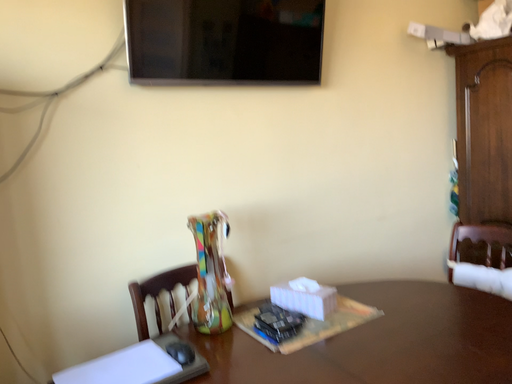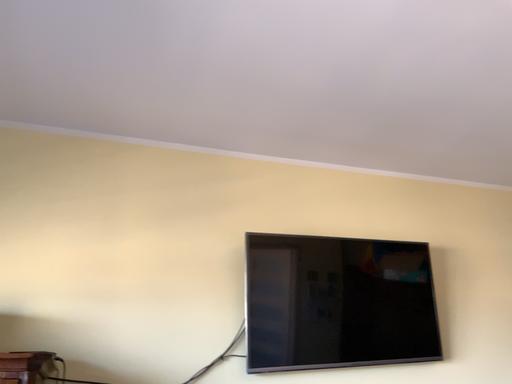
Question: Which way did the camera rotate in the video?

Choices:
 (A) rotated left
 (B) rotated right

Answer: (A)